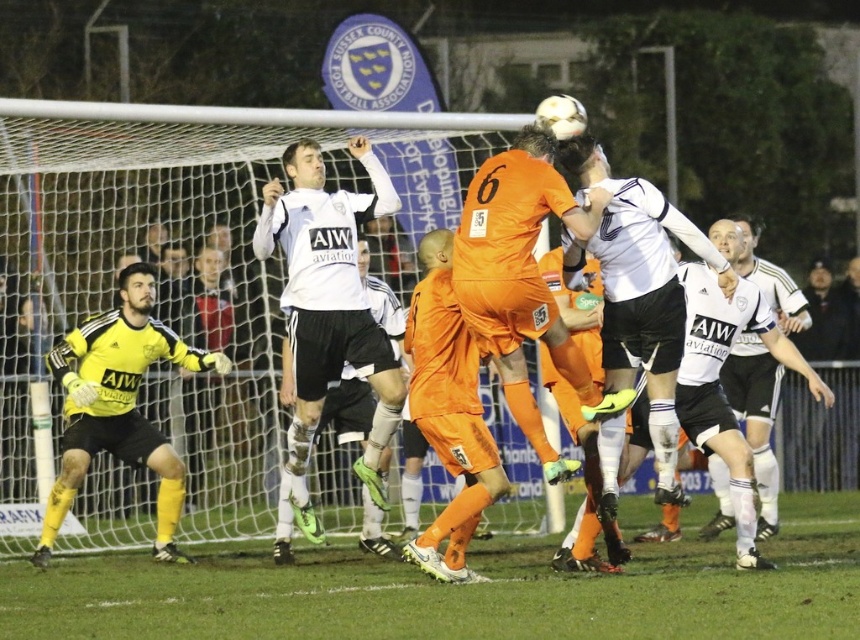
Which is below, orange matte soccer player at center or white matte jersey at center?

white matte jersey at center

Is orange matte soccer player at center thinner than white matte jersey at center?

No.

You are a GUI agent. You are given a task and a screenshot of the screen. Output one action in this format:
    pyautogui.click(x=<x>, y=<y>)
    Task: Click on the orange matte soccer player at center
    
    Given the screenshot: What is the action you would take?
    pyautogui.click(x=524, y=268)

Measure the distance between yellow matte gloves at left and camera.

yellow matte gloves at left and camera are 10.57 meters apart.

Who is positioned more to the right, yellow matte gloves at left or white matte jersey at center?

Positioned to the right is white matte jersey at center.

Image resolution: width=860 pixels, height=640 pixels. Identify the location of yellow matte gloves at left. (120, 404).

Identify the location of yellow matte gloves at left. Image resolution: width=860 pixels, height=640 pixels. (120, 404).

Between white mesh net at center and white matte jersey at upper center, which one has more height?

white matte jersey at upper center is taller.

Is white mesh net at center wider than white matte jersey at upper center?

No, white mesh net at center is not wider than white matte jersey at upper center.

The width and height of the screenshot is (860, 640). What do you see at coordinates (185, 276) in the screenshot?
I see `white mesh net at center` at bounding box center [185, 276].

Where is `white mesh net at center`? white mesh net at center is located at coordinates (185, 276).